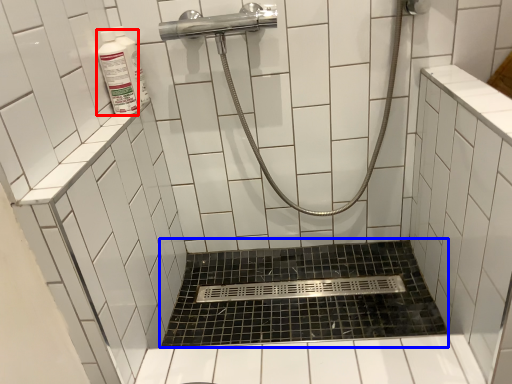
Question: Which of the following is the closest to the observer, cleaning product (highlighted by a red box) or bath (highlighted by a blue box)?

Choices:
 (A) cleaning product
 (B) bath

Answer: (A)